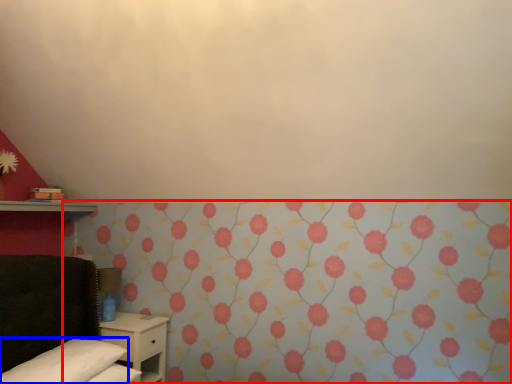
Question: Which point is closer to the camera, curtain (highlighted by a red box) or pillow (highlighted by a blue box)?

Choices:
 (A) curtain
 (B) pillow

Answer: (A)